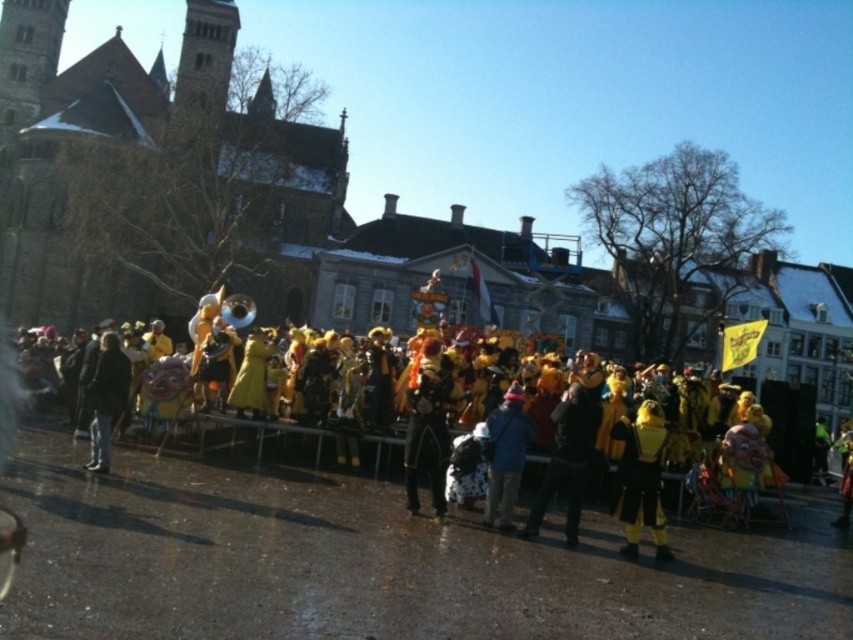
Can you confirm if orange velvet costume at center is bigger than blue fabric jacket at center?

Yes, orange velvet costume at center is bigger than blue fabric jacket at center.

Who is more forward, (431,419) or (495,419)?

Point (495,419) is more forward.

Locate an element on the screen. orange velvet costume at center is located at coordinates (427, 428).

Does black velvet costume at center have a smaller size compared to dark gray jacket at center?

No.

Is black velvet costume at center thinner than dark gray jacket at center?

Incorrect, black velvet costume at center's width is not less than dark gray jacket at center's.

Who is more forward, [618,486] or [97,381]?

Point [618,486] is more forward.

At what (x,y) coordinates should I click in order to perform the action: click on black velvet costume at center. Please return your answer as a coordinate pair (x, y). The image size is (853, 640). Looking at the image, I should click on (641, 477).

Who is more distant from viewer, [646,426] or [567,442]?

The point [646,426] is behind.

Which is more to the left, black velvet costume at center or black matte jacket at center?

black matte jacket at center

This screenshot has width=853, height=640. Describe the element at coordinates (641, 477) in the screenshot. I see `black velvet costume at center` at that location.

The height and width of the screenshot is (640, 853). Find the location of `black velvet costume at center`. black velvet costume at center is located at coordinates (641, 477).